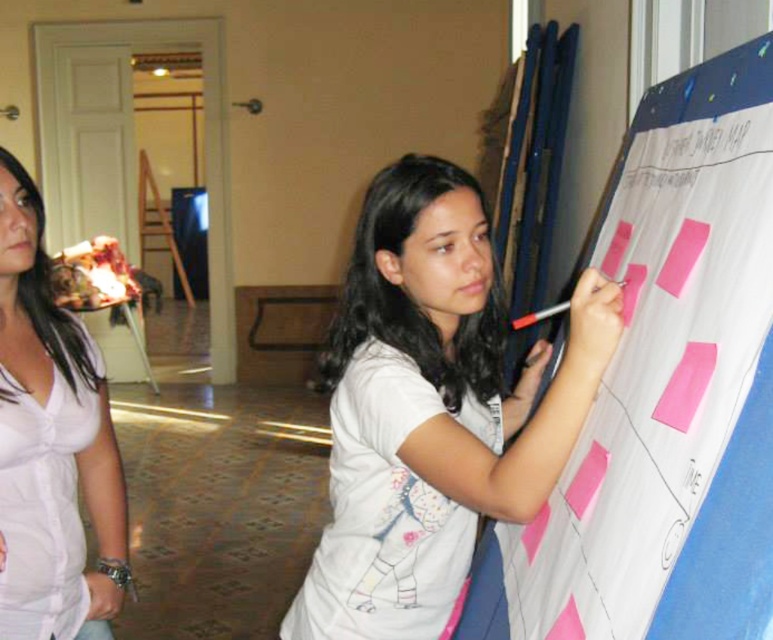
Can you confirm if pink paper at right is positioned to the right of white satin blouse at left?

Correct, you'll find pink paper at right to the right of white satin blouse at left.

How much distance is there between pink paper at right and white satin blouse at left?

34.20 inches

Does point (737, 364) come farther from viewer compared to point (36, 628)?

No, (737, 364) is in front of (36, 628).

Identify the location of pink paper at right. This screenshot has height=640, width=773. (666, 392).

How far apart are white cotton shirt at center and white plastic pen at upper right?

A distance of 10.43 inches exists between white cotton shirt at center and white plastic pen at upper right.

Identify the location of white cotton shirt at center. The width and height of the screenshot is (773, 640). (431, 410).

Which is in front, point (594, 291) or point (537, 320)?

Point (594, 291) is in front.

Find the location of a particular element. white cotton shirt at center is located at coordinates pyautogui.click(x=431, y=410).

Between point (600, 388) and point (569, 304), which one is positioned in front?

Point (569, 304) is in front.

Does point (671, 593) come closer to viewer compared to point (537, 320)?

Yes, it is.

Between point (646, 305) and point (552, 305), which one is positioned behind?

Positioned behind is point (552, 305).

In order to click on pink paper at right in this screenshot , I will do `click(666, 392)`.